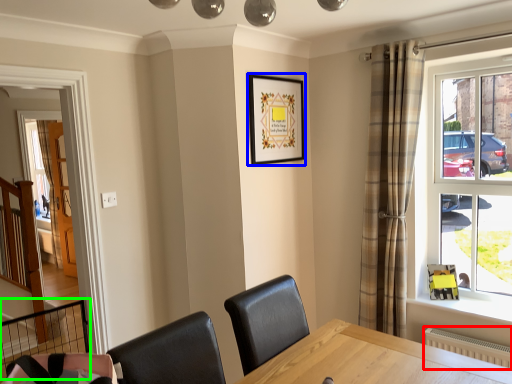
Question: Estimate the real-world distances between objects in this image. Which object is farther from radiator (highlighted by a red box), picture frame (highlighted by a blue box) or balustrade (highlighted by a green box)?

Choices:
 (A) picture frame
 (B) balustrade

Answer: (B)